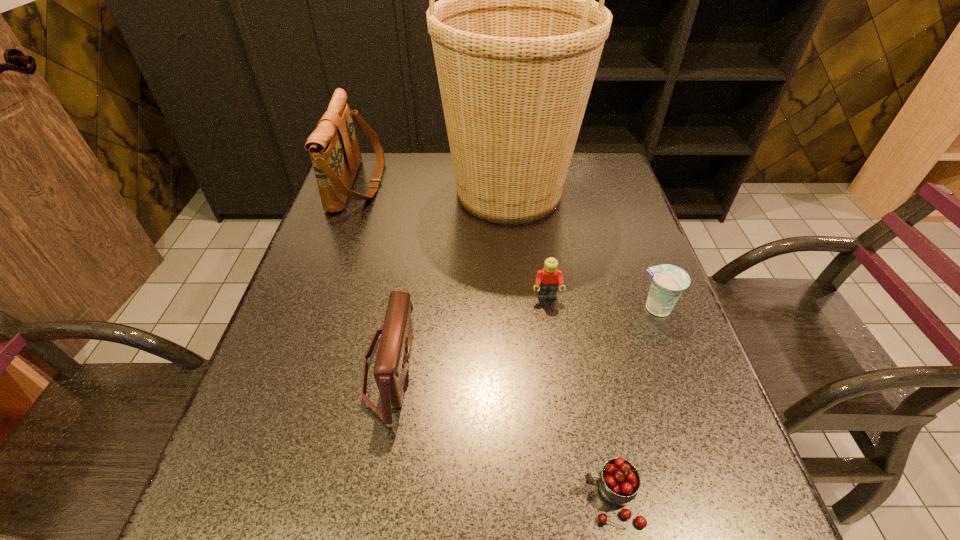
This screenshot has width=960, height=540. Identify the location of basket. (517, 37).

At what (x,y) coordinates should I click in order to perform the action: click on the leftmost object. Please return your answer as a coordinate pair (x, y). Looking at the image, I should click on (333, 146).

In order to click on the farther shoulder bag in this screenshot , I will do [333, 146].

The height and width of the screenshot is (540, 960). Identify the location of the right shoulder bag. point(393,355).

The width and height of the screenshot is (960, 540). What are the coordinates of `the shorter shoulder bag` in the screenshot? It's located at point(393,355).

I want to click on Lego, so click(x=547, y=279).

Find the location of a particular element. The height and width of the screenshot is (540, 960). the rightmost object is located at coordinates (668, 282).

In order to click on cherry in this screenshot , I will do `click(619, 481)`.

This screenshot has width=960, height=540. Find the location of `vacant space located 0.070m on the right of the basket`. vacant space located 0.070m on the right of the basket is located at coordinates (602, 192).

Find the location of `vacant space situated on the front-facing side of the fifth shortest object`. vacant space situated on the front-facing side of the fifth shortest object is located at coordinates (509, 183).